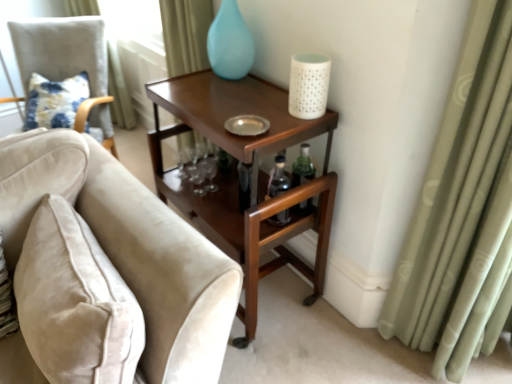
Where is `blank space to the left of white textured candle at upper right`? Image resolution: width=512 pixels, height=384 pixels. blank space to the left of white textured candle at upper right is located at coordinates (260, 106).